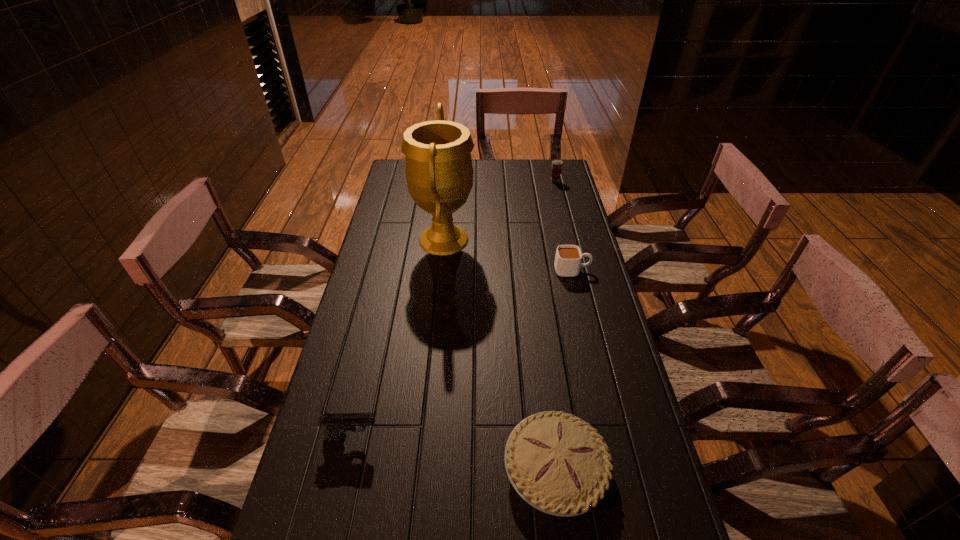
Find the location of a particular element. The image size is (960, 540). the tallest object is located at coordinates (438, 166).

Identify the location of the farthest object. (557, 164).

The image size is (960, 540). Identify the location of the fourth shortest object. (557, 164).

What are the coordinates of `pistol` in the screenshot? It's located at (336, 424).

Locate an element on the screen. The width and height of the screenshot is (960, 540). pie is located at coordinates (558, 463).

Image resolution: width=960 pixels, height=540 pixels. I want to click on the shorter cup, so click(568, 258).

Identify the location of vacant region located on the engravings side of the tallest object. (489, 240).

The image size is (960, 540). I want to click on free space located 0.240m on the side of the farther cup with the logo, so click(564, 215).

The width and height of the screenshot is (960, 540). What are the coordinates of `vacant point located 0.080m at the barrel of the pistol` in the screenshot? It's located at (413, 436).

Locate an element on the screen. vacant space situated 0.300m on the left of the pie is located at coordinates (372, 470).